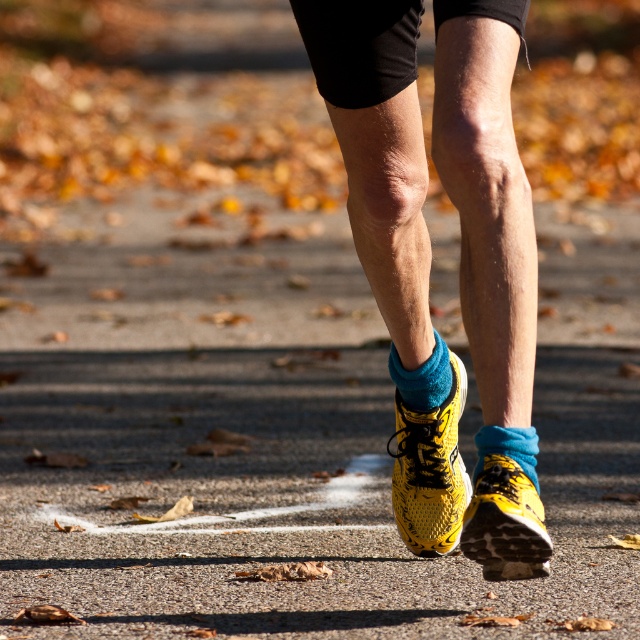
Question: Does yellow mesh running shoes at center have a lesser width compared to yellow mesh shoe at center?

Choices:
 (A) yes
 (B) no

Answer: (B)

Question: Does yellow mesh running shoes at center have a smaller size compared to teal soft cotton sock at center?

Choices:
 (A) no
 (B) yes

Answer: (A)

Question: Which point is farther to the camera?

Choices:
 (A) yellow mesh shoe at lower center
 (B) blue fleece sock at lower center
 (C) teal soft cotton sock at center
 (D) yellow mesh running shoes at center

Answer: (C)

Question: Does yellow mesh shoe at center have a larger size compared to teal soft cotton sock at center?

Choices:
 (A) yes
 (B) no

Answer: (A)

Question: Which of the following is the farthest from the observer?

Choices:
 (A) (529, 564)
 (B) (492, 448)
 (C) (400, 468)

Answer: (C)

Question: Which point appears farthest from the camera in this image?

Choices:
 (A) (499, 522)
 (B) (490, 468)
 (C) (435, 403)

Answer: (C)